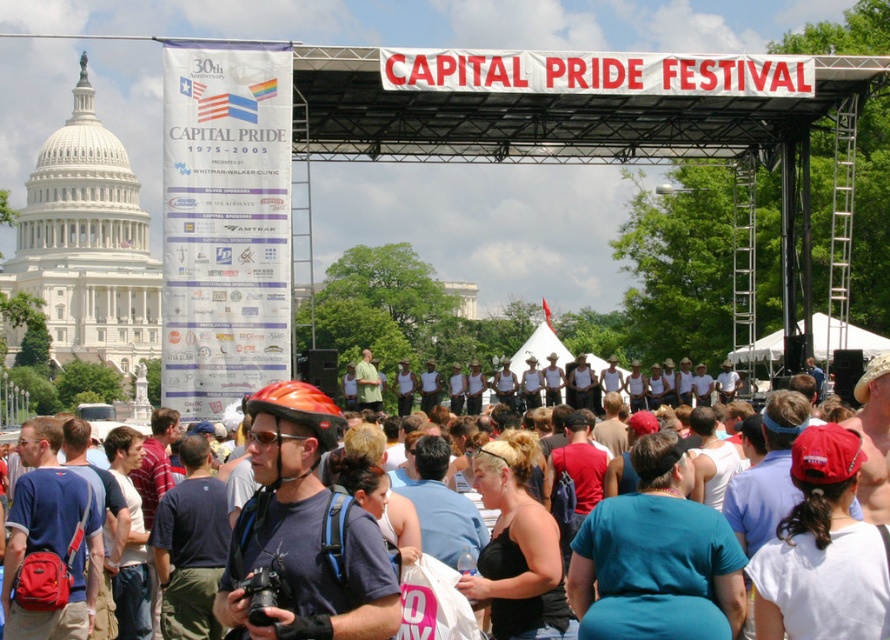
Question: Which object is farther from the camera taking this photo?

Choices:
 (A) matte orange helmet at center
 (B) matte black tank tops at center

Answer: (A)

Question: Does matte black tank tops at center have a larger size compared to matte orange helmet at center?

Choices:
 (A) no
 (B) yes

Answer: (B)

Question: Can you confirm if matte black tank tops at center is positioned above matte orange helmet at center?

Choices:
 (A) yes
 (B) no

Answer: (B)

Question: Can you confirm if matte black tank tops at center is positioned below matte orange helmet at center?

Choices:
 (A) yes
 (B) no

Answer: (A)